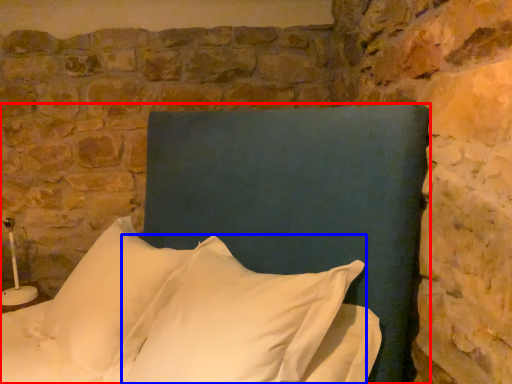
Question: Which object is closer to the camera taking this photo, bed (highlighted by a red box) or pillow (highlighted by a blue box)?

Choices:
 (A) bed
 (B) pillow

Answer: (A)